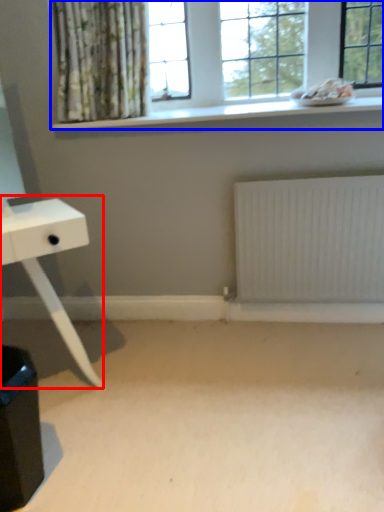
Question: Which object is further to the camera taking this photo, table (highlighted by a red box) or window (highlighted by a blue box)?

Choices:
 (A) table
 (B) window

Answer: (B)